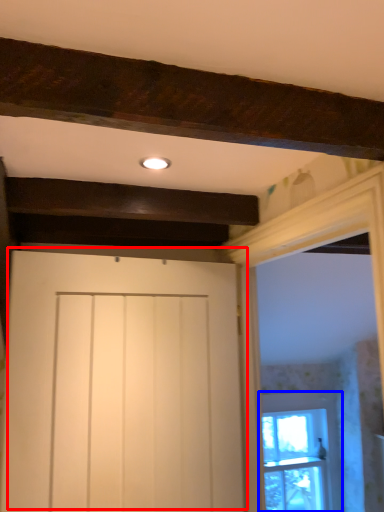
Question: Which of the following is the farthest to the observer, door (highlighted by a red box) or window (highlighted by a blue box)?

Choices:
 (A) door
 (B) window

Answer: (B)